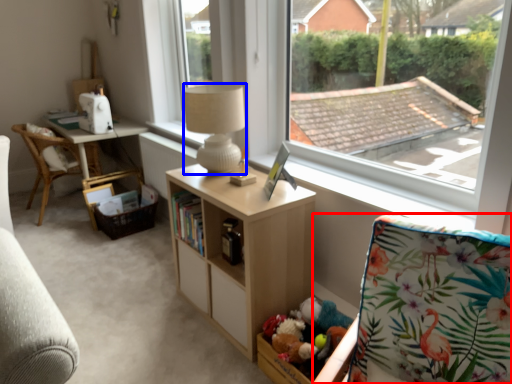
Question: Which of the following is the closest to the observer, rocking chair (highlighted by a red box) or lamp (highlighted by a blue box)?

Choices:
 (A) rocking chair
 (B) lamp

Answer: (A)